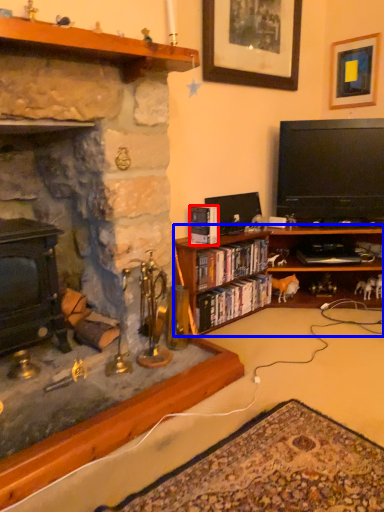
Question: Which object appears closest to the camera in this image, book (highlighted by a red box) or cabinetry (highlighted by a blue box)?

Choices:
 (A) book
 (B) cabinetry

Answer: (B)